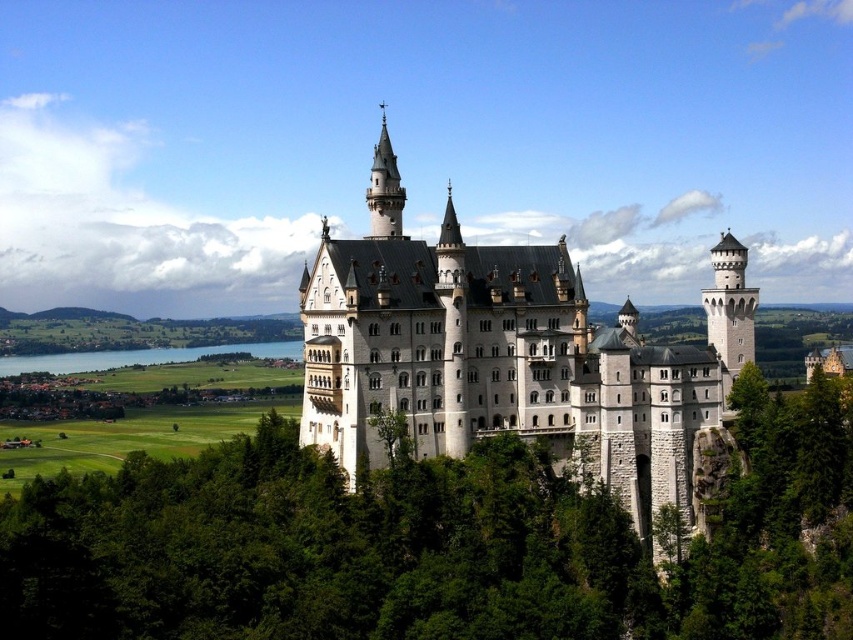
You are standing in front of the white stone castle at center, and you want to walk towards the green leafy tree at center. Which direction should you move to get closer to the tree?

The green leafy tree at center is closer to the viewer than the white stone castle at center, so you should move forward towards the tree since it is already in front of the castle.

You are a photographer planning to capture a wide shot of Neuschwanstein Castle. You notice the green leafy tree at center and the blue water at lower left in your viewfinder. Based on their widths, which object would likely block more of the castle in your photo?

The green leafy tree at center might block more of the castle in your photo since it might be wider than the blue water at lower left according to the description.